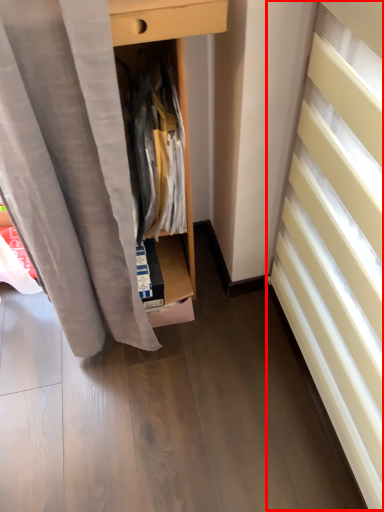
Question: Considering the relative positions of stairwell (annotated by the red box) and clothing in the image provided, where is stairwell (annotated by the red box) located with respect to the staircase?

Choices:
 (A) right
 (B) left

Answer: (A)